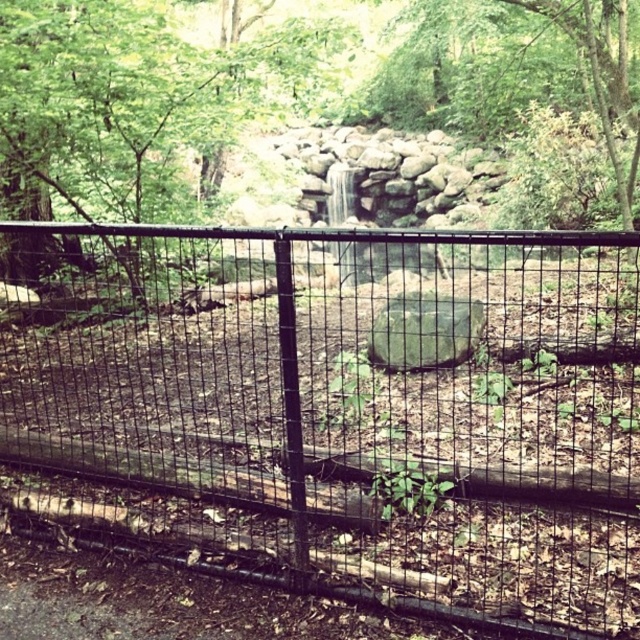
Does green leafy tree at center have a lesser height compared to green leafy tree at upper center?

Correct, green leafy tree at center is not as tall as green leafy tree at upper center.

Does green leafy tree at center have a lesser width compared to green leafy tree at upper center?

Indeed, green leafy tree at center has a lesser width compared to green leafy tree at upper center.

Measure the distance between point (19, 42) and camera.

17.96 feet

The image size is (640, 640). I want to click on green leafy tree at center, so (x=132, y=104).

Is point (468, 577) farther from viewer compared to point (401, 58)?

No.

Does black wire mesh fence at center appear over green leafy tree at upper center?

Actually, black wire mesh fence at center is below green leafy tree at upper center.

Locate an element on the screen. black wire mesh fence at center is located at coordinates coord(333,413).

Measure the distance from black wire mesh fence at center to green mossy rock at center.

black wire mesh fence at center and green mossy rock at center are 6.18 feet apart.

Can you confirm if black wire mesh fence at center is positioned above green mossy rock at center?

Correct, black wire mesh fence at center is located above green mossy rock at center.

In the scene shown: Who is more forward, (250, 289) or (400, 312)?

Point (400, 312) is in front.

Image resolution: width=640 pixels, height=640 pixels. I want to click on black wire mesh fence at center, so click(x=333, y=413).